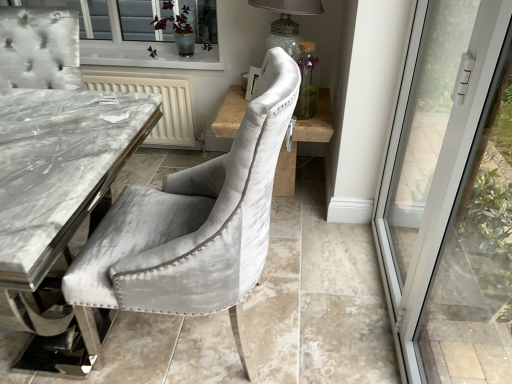
Find the location of a particular element. The height and width of the screenshot is (384, 512). free spot below velvet grey chair at center (from a real-world perspective) is located at coordinates (199, 335).